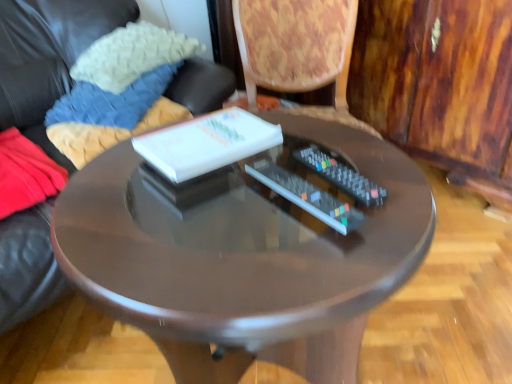
What are the coordinates of `free location in front of matte black remote control at center, positioned as the second remote control in right-to-left order` in the screenshot? It's located at (292, 277).